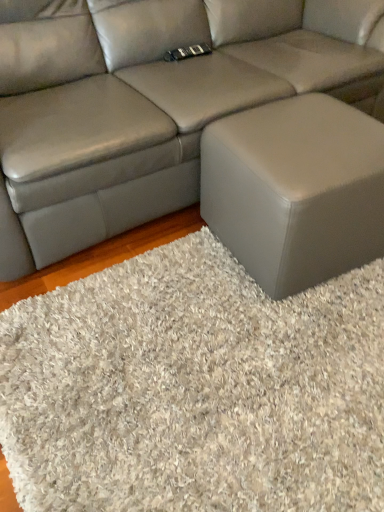
Question: Is white shaggy rug at lower right wider than matte gray ottoman at lower right?

Choices:
 (A) no
 (B) yes

Answer: (B)

Question: Does white shaggy rug at lower right lie behind matte gray ottoman at lower right?

Choices:
 (A) no
 (B) yes

Answer: (A)

Question: Is white shaggy rug at lower right in front of matte gray ottoman at lower right?

Choices:
 (A) yes
 (B) no

Answer: (A)

Question: Is white shaggy rug at lower right shorter than matte gray ottoman at lower right?

Choices:
 (A) no
 (B) yes

Answer: (B)

Question: From the image's perspective, is white shaggy rug at lower right below matte gray ottoman at lower right?

Choices:
 (A) yes
 (B) no

Answer: (A)

Question: Can you confirm if white shaggy rug at lower right is positioned to the left of matte gray ottoman at lower right?

Choices:
 (A) no
 (B) yes

Answer: (B)

Question: Is the surface of matte gray ottoman at lower right in direct contact with matte gray leather couch at center?

Choices:
 (A) no
 (B) yes

Answer: (A)

Question: Can you confirm if matte gray ottoman at lower right is smaller than matte gray leather couch at center?

Choices:
 (A) no
 (B) yes

Answer: (B)

Question: Does matte gray ottoman at lower right appear on the right side of matte gray leather couch at center?

Choices:
 (A) yes
 (B) no

Answer: (A)

Question: Is matte gray ottoman at lower right facing towards matte gray leather couch at center?

Choices:
 (A) no
 (B) yes

Answer: (A)

Question: From the image's perspective, is matte gray ottoman at lower right located beneath matte gray leather couch at center?

Choices:
 (A) yes
 (B) no

Answer: (A)

Question: Is matte gray ottoman at lower right bigger than matte gray leather couch at center?

Choices:
 (A) no
 (B) yes

Answer: (A)

Question: From a real-world perspective, is matte gray leather couch at center located higher than matte gray ottoman at lower right?

Choices:
 (A) yes
 (B) no

Answer: (A)